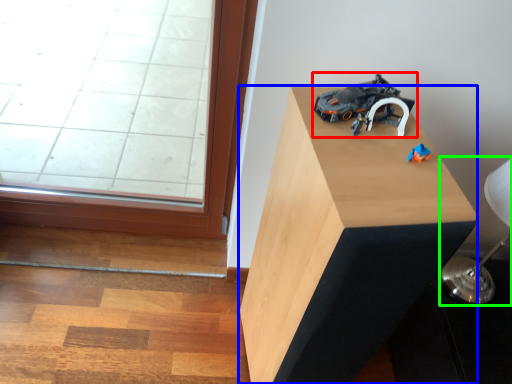
Question: Which object is the farthest from toy (highlighted by a red box)? Choose among these: furniture (highlighted by a blue box) or table lamp (highlighted by a green box).

Choices:
 (A) furniture
 (B) table lamp

Answer: (B)